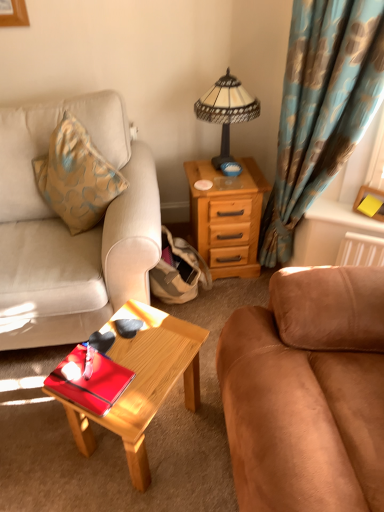
Question: In the image, is blue floral fabric curtain at right positioned in front of or behind suede beige couch at left, the 2th studio couch viewed from the right?

Choices:
 (A) front
 (B) behind

Answer: (B)

Question: From the image's perspective, is blue floral fabric curtain at right above or below suede beige couch at left, the 2th studio couch viewed from the right?

Choices:
 (A) below
 (B) above

Answer: (B)

Question: Estimate the real-world distances between objects in this image. Which object is closer to the suede beige couch at left, the 1th studio couch viewed from the left?

Choices:
 (A) wooden drawer at right
 (B) blue floral fabric curtain at right
 (C) shiny wood coffee table at center
 (D) yellow matte picture frame at upper right
 (E) glossy red tray at center

Answer: (C)

Question: Which of these objects is positioned farthest from the glossy red tray at center?

Choices:
 (A) yellow matte picture frame at upper right
 (B) stained glass lampshade at upper center
 (C) blue floral fabric curtain at right
 (D) suede brown couch at right, the 1th studio couch when ordered from right to left
 (E) shiny wood coffee table at center

Answer: (A)